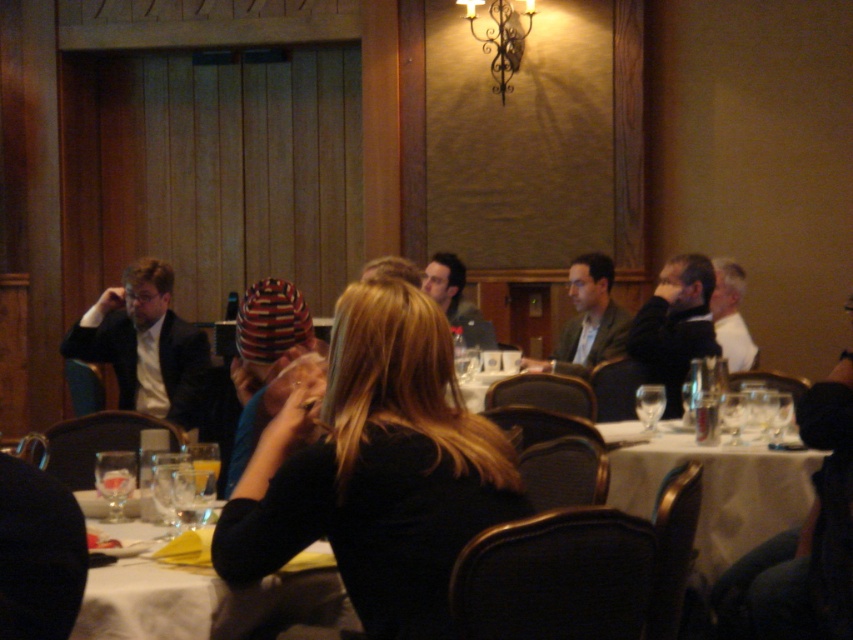
Question: Among these points, which one is farthest from the camera?

Choices:
 (A) (177, 621)
 (B) (734, 512)
 (C) (108, 502)

Answer: (B)

Question: Which is nearer to the white cloth table at center?

Choices:
 (A) clear glass wine glass at center
 (B) dark gray suit at right
 (C) white shirt at right
 (D) matte black suit at center

Answer: (A)

Question: Which object appears closest to the camera in this image?

Choices:
 (A) white cloth table at center
 (B) matte black suit at left
 (C) clear glass wine glass at center

Answer: (A)

Question: In this image, where is white cloth table at center located relative to clear glass wine glass at lower left?

Choices:
 (A) below
 (B) above

Answer: (A)

Question: Can you confirm if black knit hat at center is positioned below matte black suit at center?

Choices:
 (A) yes
 (B) no

Answer: (A)

Question: Considering the relative positions of dark gray suit at right and white shirt at right in the image provided, where is dark gray suit at right located with respect to white shirt at right?

Choices:
 (A) right
 (B) left

Answer: (B)